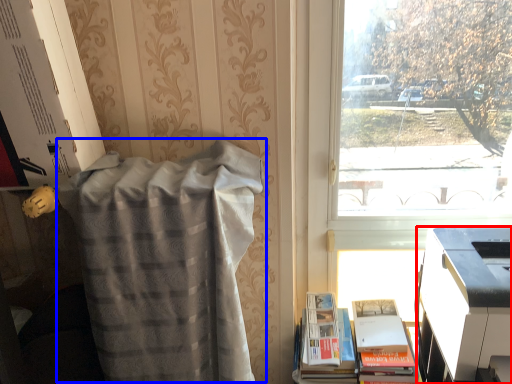
Question: Which point is further to the camera, printer (highlighted by a red box) or blanket (highlighted by a blue box)?

Choices:
 (A) printer
 (B) blanket

Answer: (B)